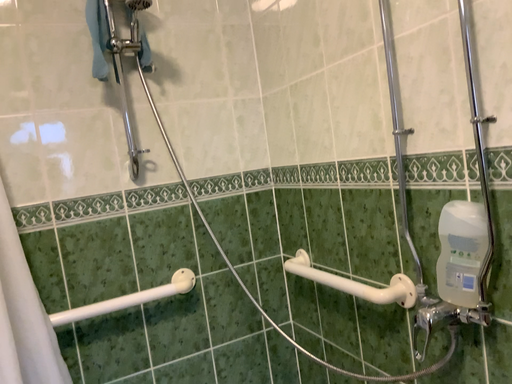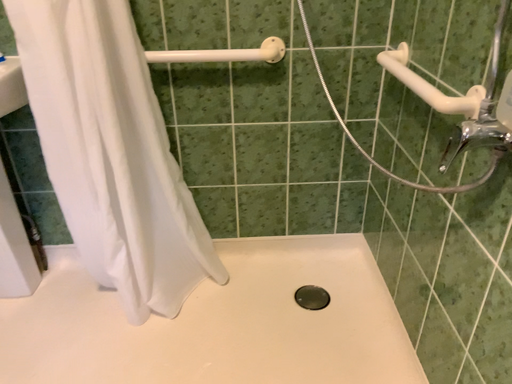
Question: How did the camera likely rotate when shooting the video?

Choices:
 (A) rotated left
 (B) rotated right

Answer: (A)